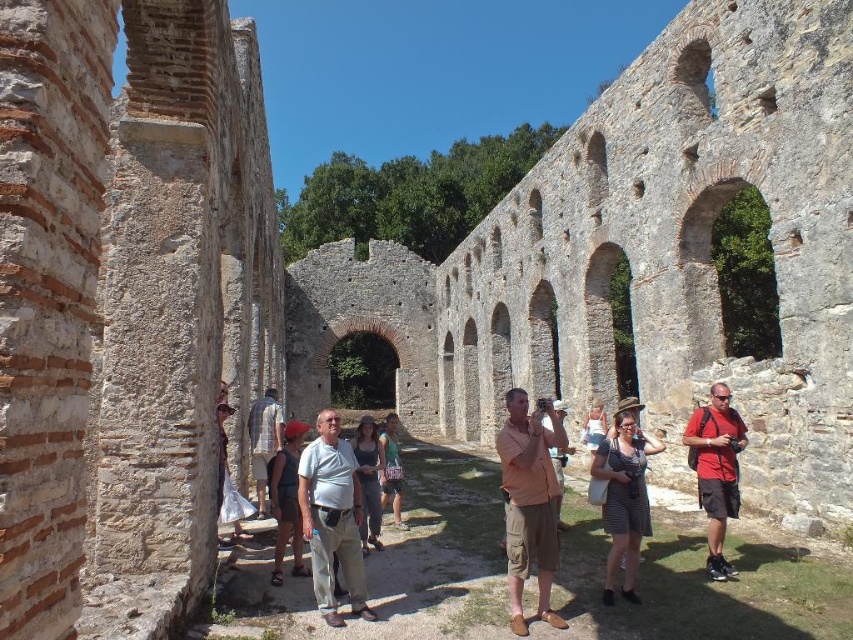
You are a photographer standing in the ancient ruins. You see a striped cotton dress at center and denim shorts at center. Which clothing item is positioned more to the right side of the scene?

The striped cotton dress at center is positioned more to the right side of the scene compared to the denim shorts at center.